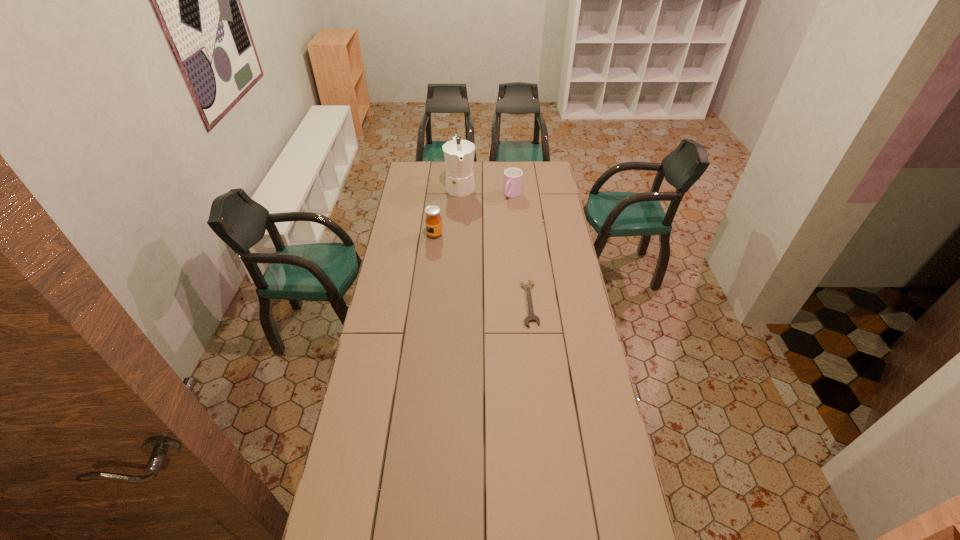
Identify the location of free location located 0.100m with the handle on the side of the cup. Image resolution: width=960 pixels, height=540 pixels. (502, 211).

I want to click on free space located with the handle on the side of the cup, so click(479, 242).

Find the location of a particular element. This screenshot has width=960, height=540. object located in the far edge section of the desktop is located at coordinates (459, 154).

In the image, there is a desktop. Where is `vacant space at the left edge`? vacant space at the left edge is located at coordinates (413, 240).

You are a GUI agent. You are given a task and a screenshot of the screen. Output one action in this format:
    pyautogui.click(x=<x>, y=<y>)
    Task: Click on the free space at the right edge
    
    Given the screenshot: What is the action you would take?
    pyautogui.click(x=588, y=440)

Locate an element on the screen. vacant space at the far left corner is located at coordinates (430, 176).

I want to click on free space that is in between the tallest object and the nearest object, so click(x=495, y=245).

Locate an element on the screen. The height and width of the screenshot is (540, 960). vacant area between the coffeepot and the cup is located at coordinates (487, 191).

At what (x,y) coordinates should I click in order to perform the action: click on vacant space that is in between the nearest object and the third farthest object. Please return your answer as a coordinate pair (x, y). Looking at the image, I should click on (482, 269).

Identify the location of free point between the nearest object and the tallest object. (495, 245).